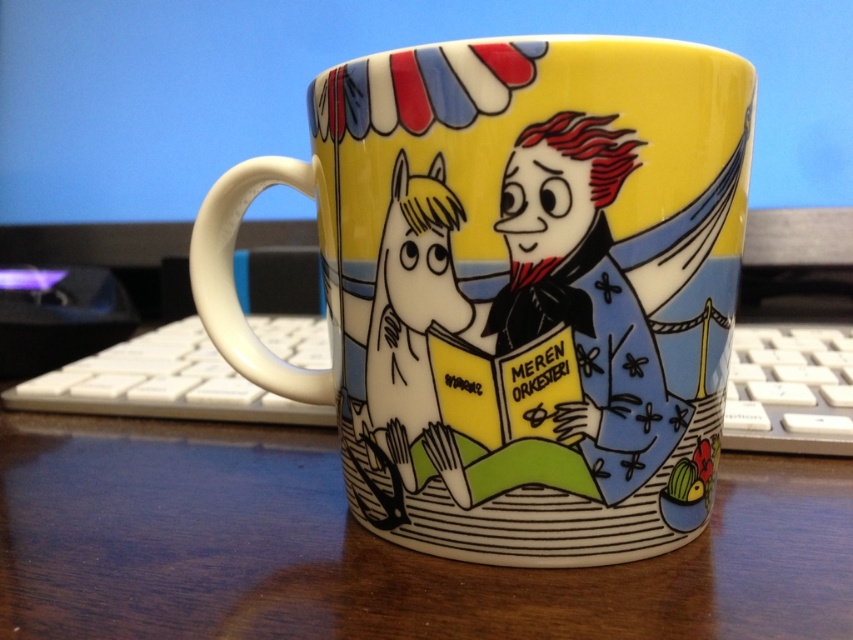
Question: Which point is farther from the camera taking this photo?

Choices:
 (A) (811, 412)
 (B) (428, 634)
 (C) (96, 403)
 (D) (318, 104)

Answer: (C)

Question: Is wooden table at center below white plastic keyboard at lower right?

Choices:
 (A) yes
 (B) no

Answer: (A)

Question: Can you confirm if glossy ceramic mug at center is smaller than white plastic keyboard at lower left?

Choices:
 (A) yes
 (B) no

Answer: (A)

Question: Can you confirm if glossy ceramic mug at center is bigger than wooden table at center?

Choices:
 (A) no
 (B) yes

Answer: (B)

Question: Estimate the real-world distances between objects in this image. Which object is farther from the white plastic keyboard at lower right?

Choices:
 (A) white plastic keyboard at lower left
 (B) wooden table at center

Answer: (A)

Question: Which of the following is the farthest from the observer?

Choices:
 (A) wooden table at center
 (B) glossy ceramic mug at center
 (C) white plastic keyboard at lower left
 (D) white plastic keyboard at lower right

Answer: (C)